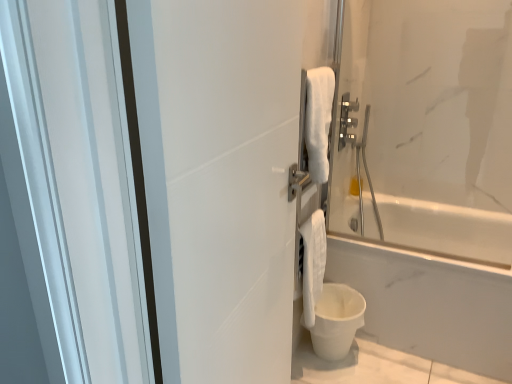
Question: Would you say white matte bucket at lower right is to the left or to the right of white soft towel at lower right in the picture?

Choices:
 (A) right
 (B) left

Answer: (A)

Question: From a real-world perspective, is white matte bucket at lower right above or below white soft towel at lower right?

Choices:
 (A) below
 (B) above

Answer: (A)

Question: Which object is positioned closest to the white matte bucket at lower right?

Choices:
 (A) white soft towel at lower right
 (B) satin nickel towel bar at upper right
 (C) white matte screen door at center

Answer: (A)

Question: Based on their relative distances, which object is farther from the white matte screen door at center?

Choices:
 (A) satin nickel towel bar at upper right
 (B) white matte bucket at lower right
 (C) white soft towel at lower right

Answer: (A)